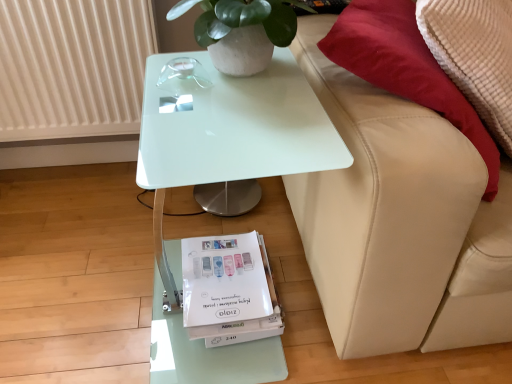
Question: Is white ribbed radiator at upper left inside the boundaries of white paper magazine at lower center, or outside?

Choices:
 (A) inside
 (B) outside

Answer: (B)

Question: Would you say white ribbed radiator at upper left is to the left or to the right of white paper magazine at lower center in the picture?

Choices:
 (A) left
 (B) right

Answer: (A)

Question: Considering the real-world distances, which object is farthest from the white glossy table at center?

Choices:
 (A) beige leather couch at right
 (B) white ribbed radiator at upper left
 (C) white paper magazine at lower center
 (D) white matte pot at upper center

Answer: (B)

Question: Which is nearer to the white paper magazine at lower center?

Choices:
 (A) beige leather couch at right
 (B) white ribbed radiator at upper left
 (C) white matte pot at upper center
 (D) white glossy table at center

Answer: (A)